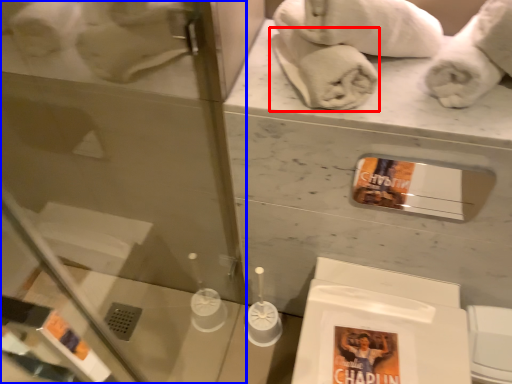
Question: Which object is further to the camera taking this photo, bath towel (highlighted by a red box) or glass door (highlighted by a blue box)?

Choices:
 (A) bath towel
 (B) glass door

Answer: (A)